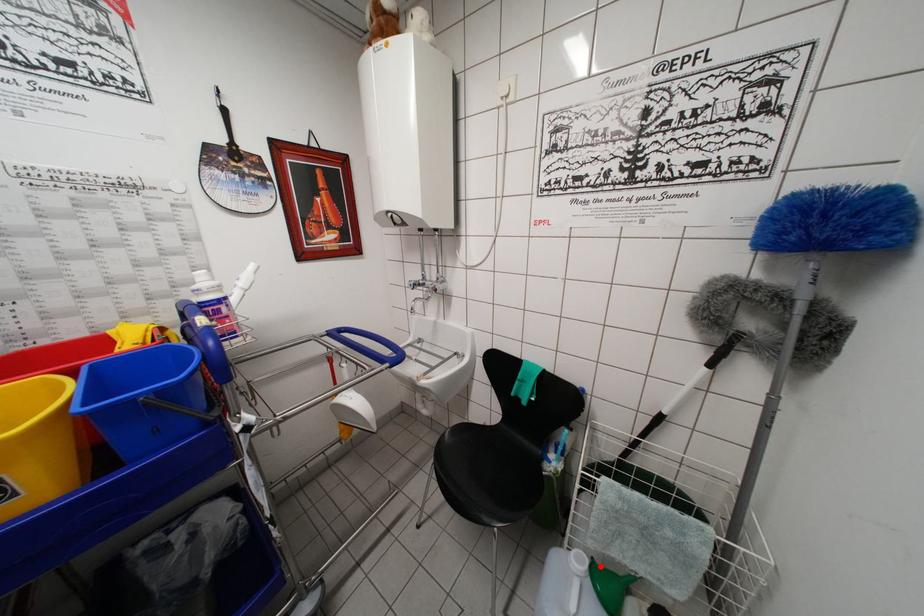
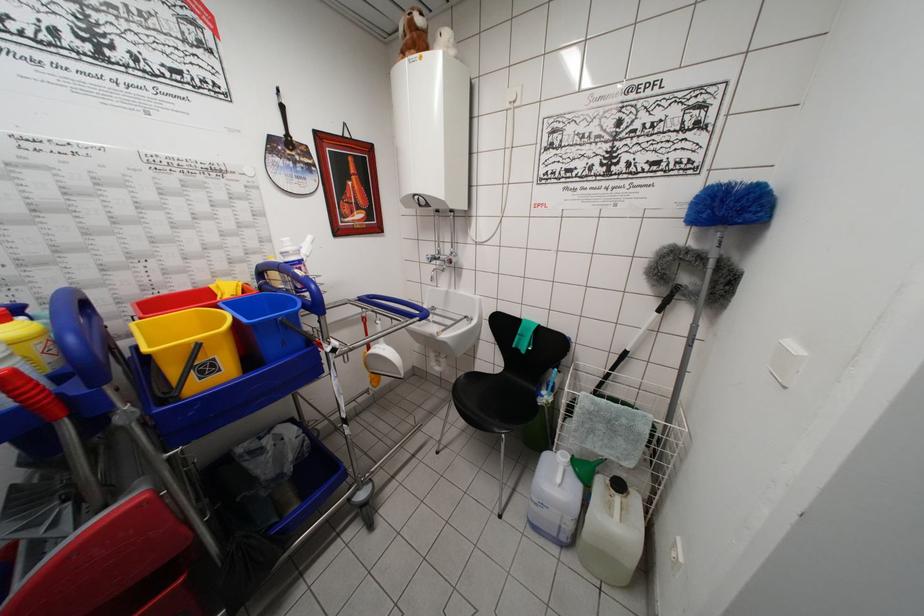
Find the pixel in the second image that matches the highlighted location in the first image.

(579, 462)